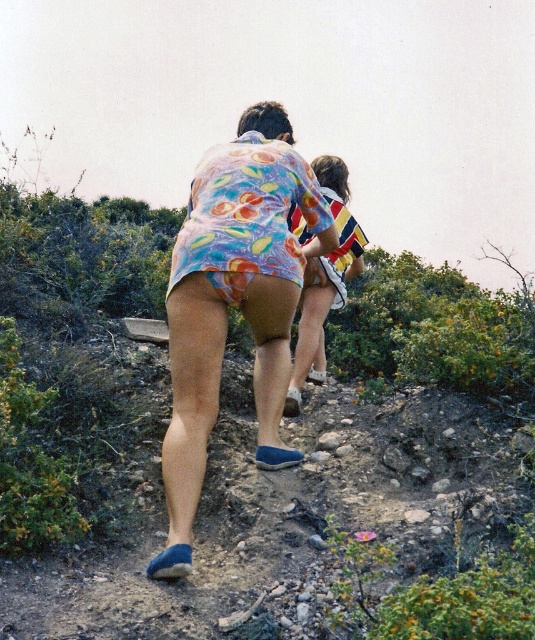
Consider the image. Does floral fabric shorts at center come behind striped fabric shirt at upper center?

No.

Based on the photo, is floral fabric shorts at center to the right of striped fabric shirt at upper center from the viewer's perspective?

Incorrect, floral fabric shorts at center is not on the right side of striped fabric shirt at upper center.

You are a GUI agent. You are given a task and a screenshot of the screen. Output one action in this format:
    pyautogui.click(x=<x>, y=<y>)
    Task: Click on the floral fabric shorts at center
    The width and height of the screenshot is (535, 640).
    Given the screenshot: What is the action you would take?
    pyautogui.click(x=233, y=301)